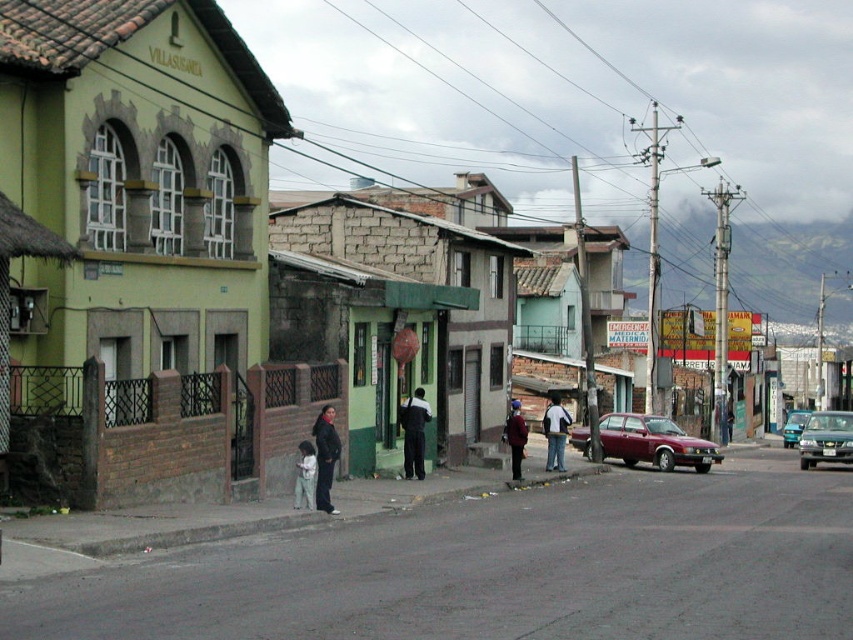
Between dark gray pants at center and light gray fabric pants at center, which one appears on the right side from the viewer's perspective?

dark gray pants at center is more to the right.

Who is more forward, (415, 436) or (310, 458)?

Point (310, 458) is in front.

I want to click on dark gray pants at center, so click(415, 433).

Consider the image. Is dark gray fabric jacket at lower center further to the viewer compared to dark gray pants at center?

No, it is not.

Can you confirm if dark gray fabric jacket at lower center is shorter than dark gray pants at center?

Yes.

What do you see at coordinates (325, 456) in the screenshot? I see `dark gray fabric jacket at lower center` at bounding box center [325, 456].

The width and height of the screenshot is (853, 640). I want to click on dark gray fabric jacket at lower center, so [x=325, y=456].

Who is positioned more to the left, metallic silver sedan at center or dark gray fabric jacket at lower center?

dark gray fabric jacket at lower center

Which of these two, metallic silver sedan at center or dark gray fabric jacket at lower center, stands shorter?

metallic silver sedan at center

Between point (798, 445) and point (331, 436), which one is positioned in front?

Point (331, 436)

Locate an element on the screen. The image size is (853, 640). metallic silver sedan at center is located at coordinates (827, 438).